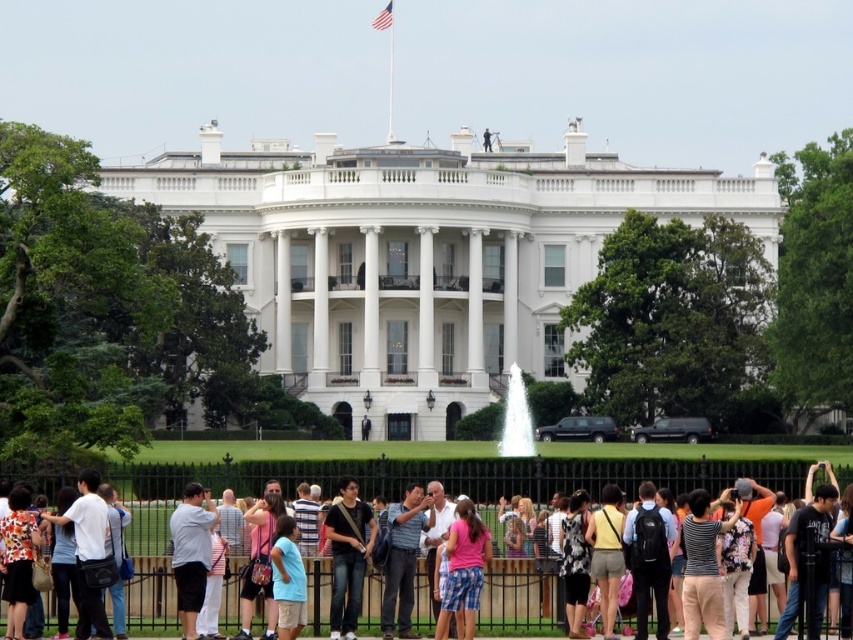
Question: Among these points, which one is farthest from the camera?

Choices:
 (A) tap(393, 566)
 (B) tap(314, 468)

Answer: (B)

Question: Which object appears farthest from the camera in this image?

Choices:
 (A) black cotton t-shirt at center
 (B) white glossy water at center
 (C) striped shirt at center

Answer: (B)

Question: Can you confirm if striped shirt at center is wider than pink cotton shirt at center?

Choices:
 (A) no
 (B) yes

Answer: (A)

Question: Does striped shirt at center appear over pink cotton shirt at center?

Choices:
 (A) no
 (B) yes

Answer: (B)

Question: Is black cotton t-shirt at center wider than striped shirt at center?

Choices:
 (A) yes
 (B) no

Answer: (A)

Question: Which object appears closest to the camera in this image?

Choices:
 (A) light blue shirt at center
 (B) striped shirt at center
 (C) white glossy water at center
 (D) pink cotton shirt at center

Answer: (D)